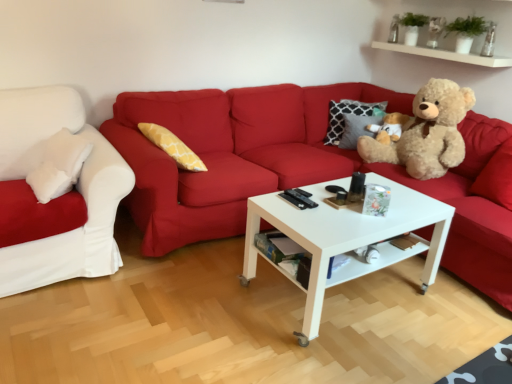
The height and width of the screenshot is (384, 512). In order to click on free region on the left part of white glossy coffee table at center in this screenshot , I will do `click(198, 303)`.